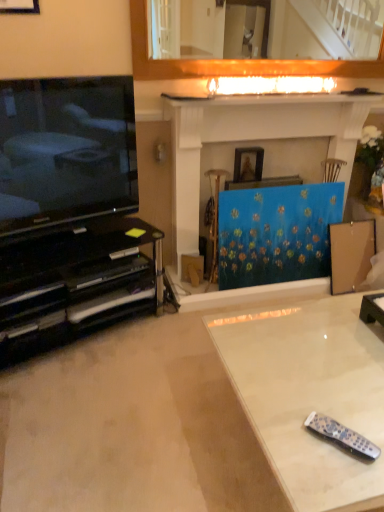
Find the location of a particular element. The image size is (384, 512). vacant space in between white glossy table at lower right and black glass tv stand at lower left is located at coordinates (134, 392).